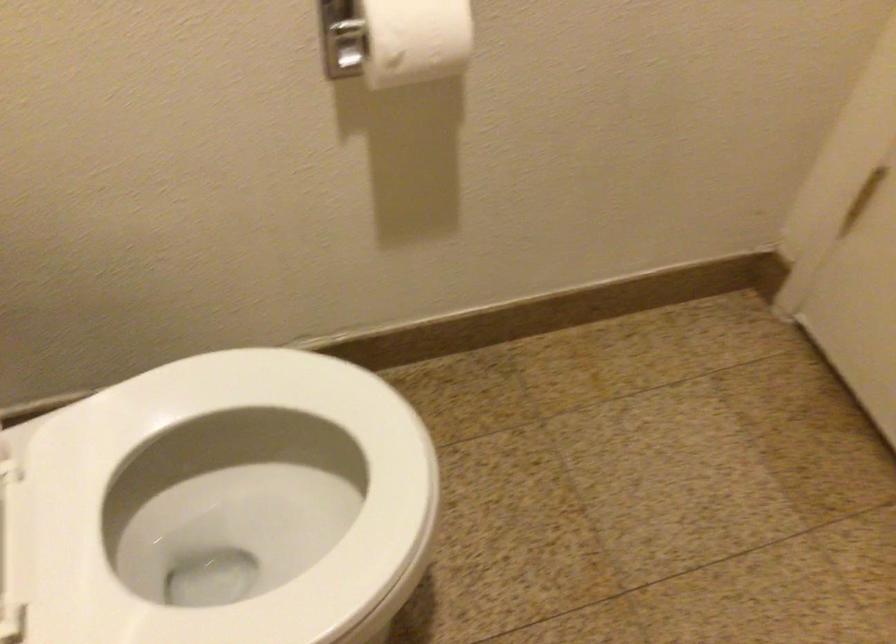
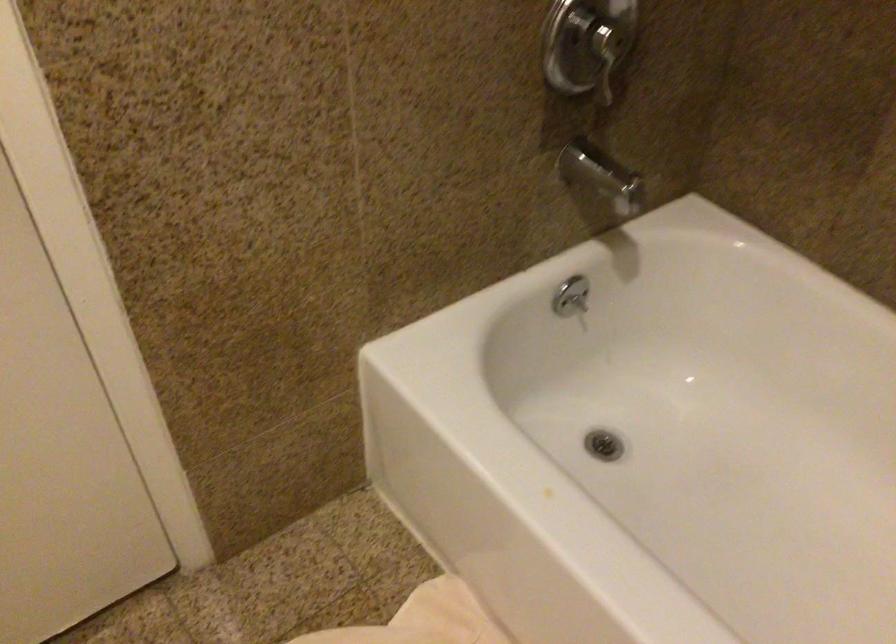
Based on the continuous images, in which direction is the camera rotating?

The rotation direction of the camera is right-down.